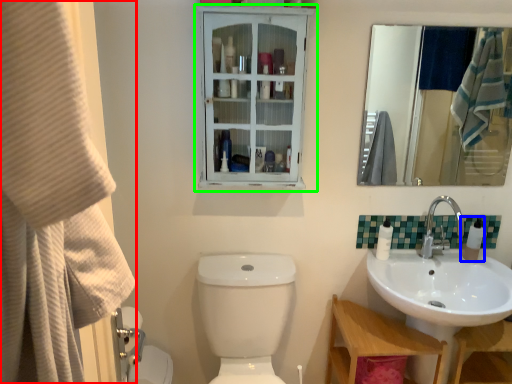
Question: Estimate the real-world distances between objects in this image. Which object is farther from shower curtain (highlighted by a red box), soap dispenser (highlighted by a blue box) or medicine cabinet (highlighted by a green box)?

Choices:
 (A) soap dispenser
 (B) medicine cabinet

Answer: (A)